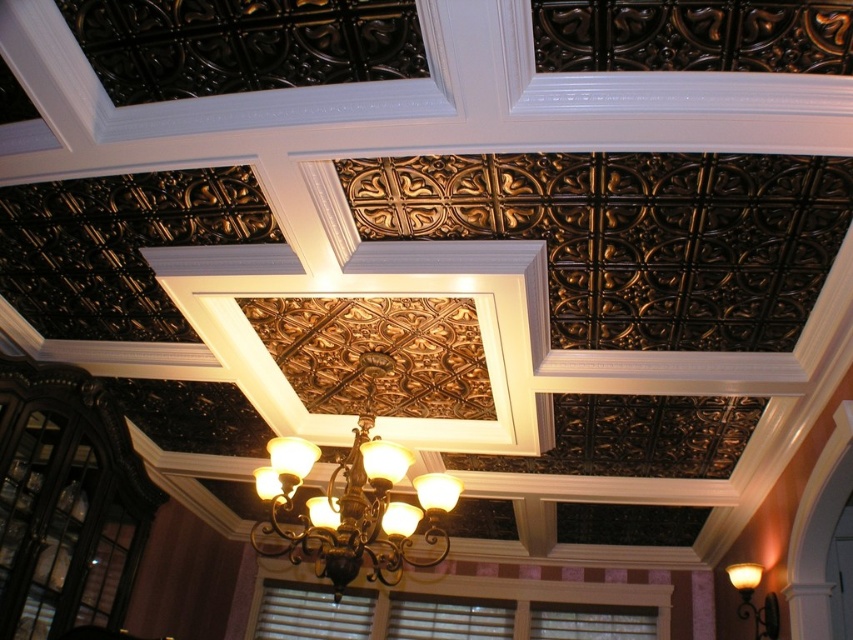
You are an interior designer planning to install a new light fixture. You see the bronze textured chandelier at center and the matte gold wall sconce at upper right. Which light fixture is positioned higher in the room?

The bronze textured chandelier at center is positioned higher in the room than the matte gold wall sconce at upper right.

Based on the photo, you are an interior designer planning to install a new light fixture between the bronze textured chandelier at center and the matte gold wall sconce at upper right. The new fixture requires a minimum of 5 feet of space between it and any existing fixtures. Based on the current spacing between the two existing lights, can the new fixture be safely placed between them?

The bronze textured chandelier at center and matte gold wall sconce at upper right are 6.52 feet apart. Since the new fixture requires a minimum of 5 feet of space between it and any existing fixtures, placing it between them would require at least 5 feet from each, totaling 10 feet. However, the current distance is only 6.52 feet, so the new fixture cannot be safely placed between them without violating the spacing requirement.

You are standing in the room and looking up at the ceiling. There is a point marked at coordinates point (355,500). What object is located at that point?

The bronze textured chandelier at center is located at point (355,500).